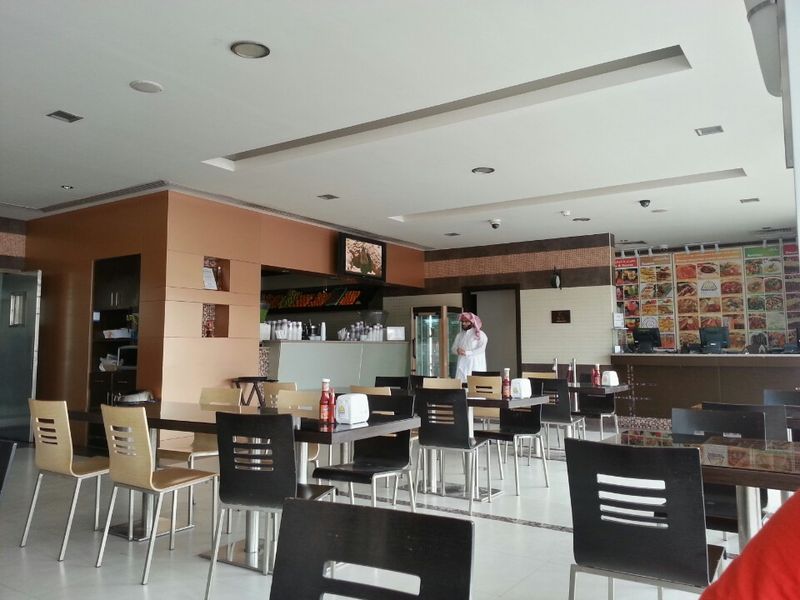
Locate an element on the screen. Image resolution: width=800 pixels, height=600 pixels. white ceiling is located at coordinates (62, 13), (726, 218), (406, 200), (377, 23), (724, 51).